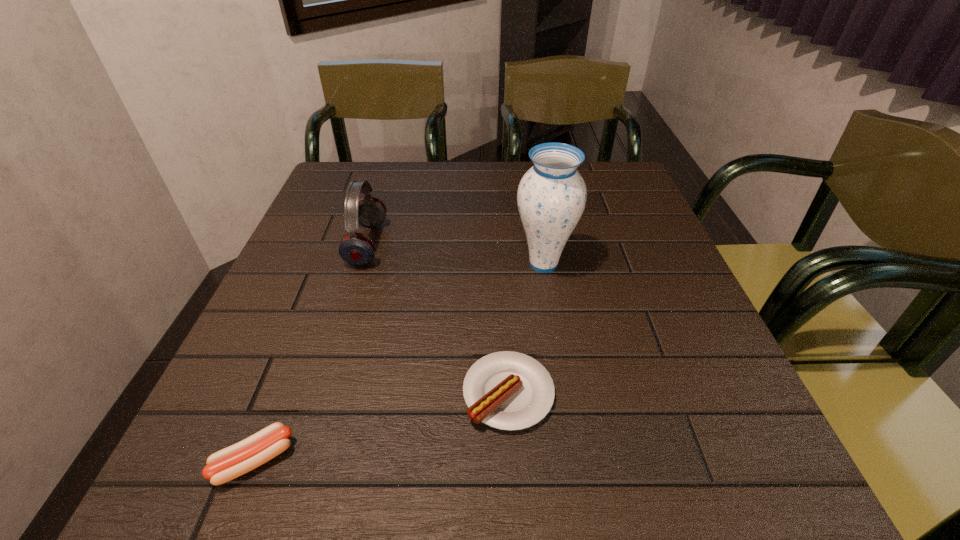
Image resolution: width=960 pixels, height=540 pixels. What are the coordinates of `vase` in the screenshot? It's located at [x=551, y=197].

Where is `the third shortest object`? the third shortest object is located at coordinates (357, 249).

Identify the location of the right sausage. The image size is (960, 540). (507, 390).

Where is `the left sausage`? This screenshot has height=540, width=960. the left sausage is located at coordinates (229, 463).

Identify the location of free space located 0.360m on the back of the tallest object. This screenshot has width=960, height=540. (528, 170).

Where is `free point located 0.310m on the ear cups of the third shortest object`? Image resolution: width=960 pixels, height=540 pixels. free point located 0.310m on the ear cups of the third shortest object is located at coordinates (516, 244).

Locate an element on the screen. The width and height of the screenshot is (960, 540). vacant space positioned 0.060m on the back of the right sausage is located at coordinates (505, 331).

I want to click on blank space located 0.360m on the right of the left sausage, so click(537, 460).

Find the location of a particular element. The width and height of the screenshot is (960, 540). object that is at the near edge is located at coordinates (229, 463).

Identify the location of earphone present at the left edge. Image resolution: width=960 pixels, height=540 pixels. (357, 249).